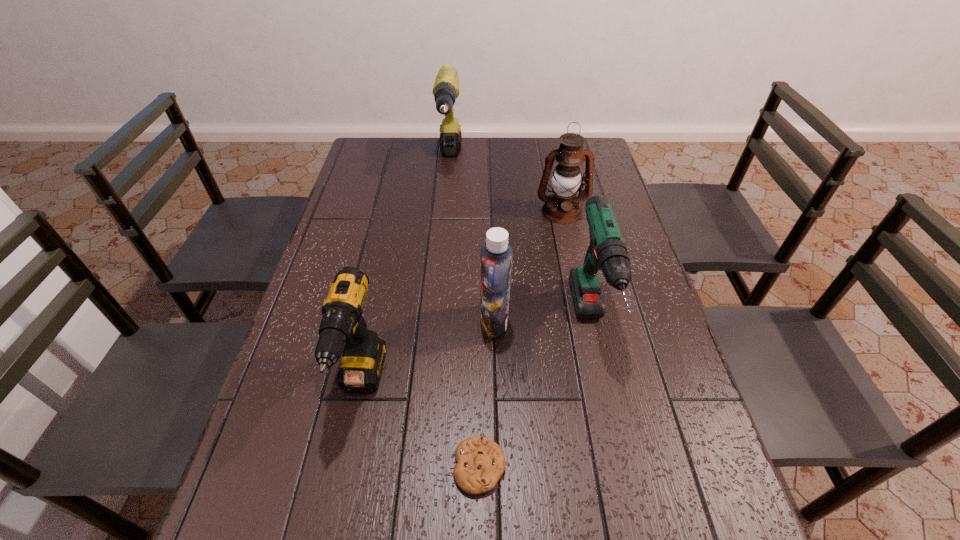
The image size is (960, 540). Identify the location of vacant space at the far edge of the desktop. (509, 153).

Image resolution: width=960 pixels, height=540 pixels. What are the coordinates of `free space at the left edge of the desktop` in the screenshot? It's located at (352, 174).

The height and width of the screenshot is (540, 960). In the image, there is a desktop. What are the coordinates of `vacant region at the right edge` in the screenshot? It's located at (655, 309).

Find the location of a particular element. The image size is (960, 540). free region at the far left corner of the desktop is located at coordinates (397, 151).

You are a GUI agent. You are given a task and a screenshot of the screen. Output one action in this format:
    pyautogui.click(x=<x>, y=<y>)
    Task: Click on the free space that is in between the lantern and the cookie
    
    Given the screenshot: What is the action you would take?
    pyautogui.click(x=520, y=339)

Locate an element on the screen. This screenshot has width=960, height=540. free spot between the fifth nearest object and the leftmost drill is located at coordinates coord(462,298).

The width and height of the screenshot is (960, 540). I want to click on unoccupied position between the second drill from left to right and the rightmost drill, so click(x=520, y=244).

What are the coordinates of `vacant space in between the leftmost drill and the fifth nearest object` in the screenshot? It's located at (462, 298).

Locate an element on the screen. vacant space in between the farthest drill and the leftmost drill is located at coordinates (406, 273).

The image size is (960, 540). Find the location of `unoccupied area between the leftmost object and the lantern`. unoccupied area between the leftmost object and the lantern is located at coordinates (462, 298).